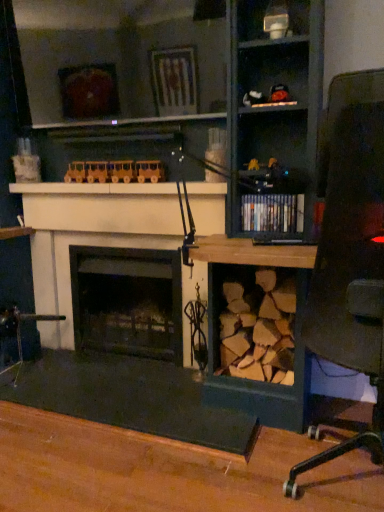
Image resolution: width=384 pixels, height=512 pixels. What do you see at coordinates (90, 234) in the screenshot? I see `white matte fireplace at center, acting as the 2th fireplace starting from the back` at bounding box center [90, 234].

Measure the distance between wooden desk at center and camera.

5.44 feet.

At what (x,y) coordinates should I click in order to perform the action: click on white matte fireplace at center, positioned as the 1th fireplace in front-to-back order. Please return your answer as a coordinate pair (x, y). Looking at the image, I should click on (90, 234).

Based on the photo, is wooden train at upper center, which is the second toy in right-to-left order, smaller than white glossy vase at upper center?

No, wooden train at upper center, which is the second toy in right-to-left order, is not smaller than white glossy vase at upper center.

Considering the relative positions of wooden train at upper center, which appears as the second toy when viewed from the top, and white glossy vase at upper center in the image provided, is wooden train at upper center, which appears as the second toy when viewed from the top, to the left or to the right of white glossy vase at upper center?

Clearly, wooden train at upper center, which appears as the second toy when viewed from the top, is on the left of white glossy vase at upper center in the image.

Is wooden train at upper center, which appears as the second toy when viewed from the top, surrounding white glossy vase at upper center?

No, white glossy vase at upper center is not a part of wooden train at upper center, which appears as the second toy when viewed from the top.

Between point (162, 166) and point (297, 27), which one is positioned in front?

Positioned in front is point (297, 27).

Is white glossy vase at upper center thinner than wooden train at upper center, which appears as the second toy when viewed from the top?

In fact, white glossy vase at upper center might be wider than wooden train at upper center, which appears as the second toy when viewed from the top.

From the image's perspective, relative to wooden train at upper center, positioned as the 1th toy in bottom-to-top order, is white glossy vase at upper center above or below?

white glossy vase at upper center is situated higher than wooden train at upper center, positioned as the 1th toy in bottom-to-top order, in the image.

Does white glossy vase at upper center appear on the right side of wooden train at upper center, which is the 1th toy from left to right?

Yes, white glossy vase at upper center is to the right of wooden train at upper center, which is the 1th toy from left to right.

Considering the relative positions of matte black toy car at upper center, the first toy positioned from the right, and white glossy vase at upper center in the image provided, is matte black toy car at upper center, the first toy positioned from the right, in front of white glossy vase at upper center?

No, matte black toy car at upper center, the first toy positioned from the right, is further to the viewer.

Could you tell me if matte black toy car at upper center, the second toy from the bottom, is turned towards white glossy vase at upper center?

No, matte black toy car at upper center, the second toy from the bottom, is not oriented towards white glossy vase at upper center.

Is matte black toy car at upper center, the first toy positioned from the top, inside the boundaries of white glossy vase at upper center, or outside?

matte black toy car at upper center, the first toy positioned from the top, lies outside white glossy vase at upper center.

Is matte black toy car at upper center, which ranks as the 2th toy in left-to-right order, bigger than white glossy vase at upper center?

Incorrect, matte black toy car at upper center, which ranks as the 2th toy in left-to-right order, is not larger than white glossy vase at upper center.

Is wooden desk at center bigger than white glossy vase at upper center?

Indeed, wooden desk at center has a larger size compared to white glossy vase at upper center.

Consider the image. Is wooden desk at center not within white glossy vase at upper center?

Yes, wooden desk at center is not within white glossy vase at upper center.

Is wooden desk at center wider than white glossy vase at upper center?

Yes.

Considering the positions of objects wooden desk at center and white glossy vase at upper center in the image provided, who is in front, wooden desk at center or white glossy vase at upper center?

wooden desk at center.

Can you tell me how much white glossy vase at upper center and white matte fireplace at center, positioned as the 1th fireplace in front-to-back order, differ in facing direction?

There is a 0.000844-degree angle between the facing directions of white glossy vase at upper center and white matte fireplace at center, positioned as the 1th fireplace in front-to-back order.

From a real-world perspective, between white glossy vase at upper center and white matte fireplace at center, acting as the 2th fireplace starting from the back, who is vertically higher?

white glossy vase at upper center.

Is white glossy vase at upper center oriented towards white matte fireplace at center, acting as the 2th fireplace starting from the back?

No, white glossy vase at upper center is not facing towards white matte fireplace at center, acting as the 2th fireplace starting from the back.

Is white glossy vase at upper center far away from white matte fireplace at center, positioned as the 1th fireplace in front-to-back order?

white glossy vase at upper center is positioned a significant distance from white matte fireplace at center, positioned as the 1th fireplace in front-to-back order.

Does point (66, 281) appear closer or farther from the camera than point (147, 170)?

Point (66, 281) appears to be farther away from the viewer than point (147, 170).

Which object is positioned more to the left, white matte fireplace at center, positioned as the 1th fireplace in front-to-back order, or wooden train at upper center, positioned as the 1th toy in bottom-to-top order?

Positioned to the left is white matte fireplace at center, positioned as the 1th fireplace in front-to-back order.

Is white matte fireplace at center, positioned as the 1th fireplace in front-to-back order, positioned with its back to wooden train at upper center, which appears as the second toy when viewed from the top?

white matte fireplace at center, positioned as the 1th fireplace in front-to-back order, is not turned away from wooden train at upper center, which appears as the second toy when viewed from the top.

Is white matte fireplace at center, positioned as the 1th fireplace in front-to-back order, not within wooden train at upper center, which is the 1th toy from left to right?

Yes.

Is wooden desk at center to the right of wooden train at upper center, marked as the first toy in a back-to-front arrangement, from the viewer's perspective?

No, wooden desk at center is not to the right of wooden train at upper center, marked as the first toy in a back-to-front arrangement.

Which is less distant, (129,234) or (136,172)?

The point (136,172) is closer.

Relative to wooden train at upper center, marked as the first toy in a back-to-front arrangement, is wooden desk at center in front or behind?

In the image, wooden desk at center appears in front of wooden train at upper center, marked as the first toy in a back-to-front arrangement.

What's the angular difference between wooden desk at center and wooden train at upper center, which is the 1th toy from left to right,'s facing directions?

0.00288 degrees separate the facing orientations of wooden desk at center and wooden train at upper center, which is the 1th toy from left to right.

Locate an element on the screen. the 2nd toy counting from the left side of the white glossy vase at upper center is located at coordinates (115, 172).

The height and width of the screenshot is (512, 384). In order to click on shelf located above the wooden train at upper center, which is the 1th toy from left to right (from a real-world perspective) in this screenshot , I will do `click(271, 19)`.

Which object lies further to the anchor point wooden train at upper center, the second toy viewed from the front, black matte fireplace at center, acting as the first fireplace starting from the back, or shiny black books at center?

shiny black books at center lies further to wooden train at upper center, the second toy viewed from the front, than the other object.

Estimate the real-world distances between objects in this image. Which object is closer to wooden desk at center, white glossy vase at upper center or wooden train at upper center, marked as the first toy in a back-to-front arrangement?

wooden train at upper center, marked as the first toy in a back-to-front arrangement, is closer to wooden desk at center.

Estimate the real-world distances between objects in this image. Which object is closer to matte black toy car at upper center, the first toy positioned from the right, white glossy vase at upper center or wooden train at upper center, positioned as the 1th toy in bottom-to-top order?

white glossy vase at upper center lies closer to matte black toy car at upper center, the first toy positioned from the right, than the other object.

Estimate the real-world distances between objects in this image. Which object is further from wooden train at upper center, which is the second toy in right-to-left order, shiny black books at center or white matte fireplace at center, acting as the 2th fireplace starting from the back?

Among the two, shiny black books at center is located further to wooden train at upper center, which is the second toy in right-to-left order.

Which object lies further to the anchor point matte black toy car at upper center, the first toy positioned from the top, shiny black books at center or white glossy vase at upper center?

shiny black books at center lies further to matte black toy car at upper center, the first toy positioned from the top, than the other object.

Which object lies nearer to the anchor point white glossy vase at upper center, black matte fireplace at center, which appears as the 2th fireplace when viewed from the front, or wooden train at upper center, which is the 1th toy from left to right?

Based on the image, wooden train at upper center, which is the 1th toy from left to right, appears to be nearer to white glossy vase at upper center.

Based on their spatial positions, is black matte fireplace at center, acting as the first fireplace starting from the back, or white matte fireplace at center, positioned as the 1th fireplace in front-to-back order, closer to wooden train at upper center, positioned as the 1th toy in bottom-to-top order?

white matte fireplace at center, positioned as the 1th fireplace in front-to-back order.

Looking at this image, considering their positions, is shiny black books at center positioned closer to matte black toy car at upper center, which is counted as the 1th toy, starting from the front, than white matte fireplace at center, positioned as the 1th fireplace in front-to-back order?

Among the two, shiny black books at center is located nearer to matte black toy car at upper center, which is counted as the 1th toy, starting from the front.

Locate an element on the screen. Image resolution: width=384 pixels, height=512 pixels. fireplace that lies between wooden train at upper center, marked as the first toy in a back-to-front arrangement, and black matte fireplace at center, acting as the first fireplace starting from the back, from top to bottom is located at coordinates (90, 234).

The height and width of the screenshot is (512, 384). Identify the location of fireplace between matte black toy car at upper center, the first toy positioned from the top, and black matte fireplace at center, which appears as the 2th fireplace when viewed from the front, in the up-down direction. (90, 234).

Locate an element on the screen. The image size is (384, 512). book between matte black toy car at upper center, which is counted as the 1th toy, starting from the front, and black matte fireplace at center, which appears as the 2th fireplace when viewed from the front, in the up-down direction is located at coordinates (272, 213).

Identify the location of toy between matte black toy car at upper center, the first toy positioned from the top, and black matte fireplace at center, which appears as the 2th fireplace when viewed from the front, in the vertical direction. Image resolution: width=384 pixels, height=512 pixels. (115, 172).